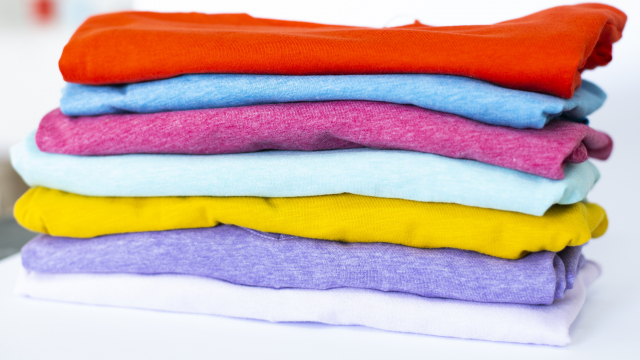
Find the location of a particular element. Image resolution: width=640 pixels, height=360 pixels. folded shirts is located at coordinates (363, 307), (367, 270), (372, 221), (386, 171), (395, 125), (397, 87), (397, 58).